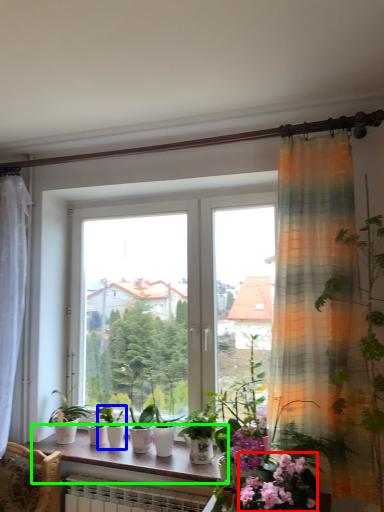
Question: Which object is the closest to the flower (highlighted by a red box)? Choose among these: houseplant (highlighted by a blue box) or window sill (highlighted by a green box).

Choices:
 (A) houseplant
 (B) window sill

Answer: (B)